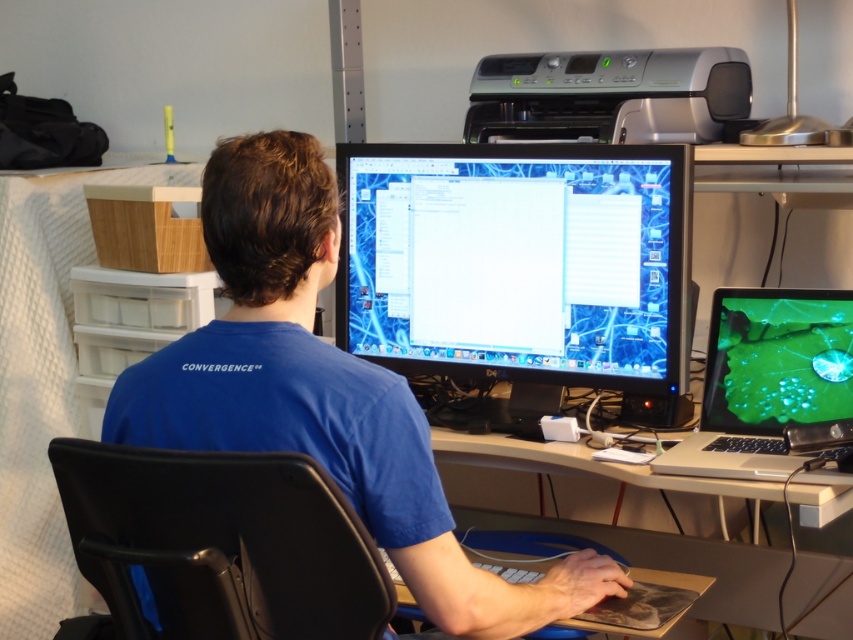
From the picture: Who is positioned more to the right, blue cotton shirt at center or shiny silver laptop at lower right?

Positioned to the right is shiny silver laptop at lower right.

Measure the distance between point [560,618] and camera.

Point [560,618] is 4.93 feet away from camera.

Image resolution: width=853 pixels, height=640 pixels. I want to click on blue cotton shirt at center, so click(321, 392).

Is matte black monitor at center further to camera compared to black leather chair at center?

Yes, it is behind black leather chair at center.

Is matte black monitor at center smaller than black leather chair at center?

No.

Between point (433, 324) and point (85, 522), which one is positioned in front?

Point (85, 522) is more forward.

Image resolution: width=853 pixels, height=640 pixels. What are the coordinates of `matte black monitor at center` in the screenshot? It's located at (521, 264).

You are a GUI agent. You are given a task and a screenshot of the screen. Output one action in this format:
    pyautogui.click(x=<x>, y=<y>)
    Task: Click on the black leather chair at center
    The height and width of the screenshot is (640, 853).
    Given the screenshot: What is the action you would take?
    pyautogui.click(x=221, y=541)

The width and height of the screenshot is (853, 640). Describe the element at coordinates (221, 541) in the screenshot. I see `black leather chair at center` at that location.

Identify the location of black leather chair at center. (221, 541).